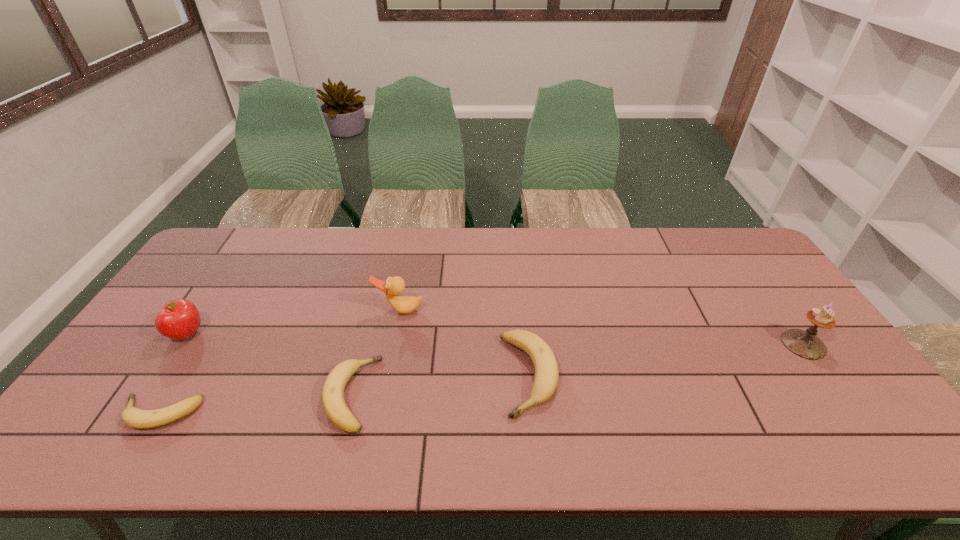
Where is `blank space located 0.070m on the back of the second shortest object`? blank space located 0.070m on the back of the second shortest object is located at coordinates (366, 339).

The height and width of the screenshot is (540, 960). I want to click on free space located 0.250m on the back of the fifth object from left to right, so click(x=519, y=279).

In order to click on free space located 0.110m on the right of the apple in this screenshot , I will do `click(243, 334)`.

Image resolution: width=960 pixels, height=540 pixels. Identify the location of blank space located 0.180m on the left of the candle holder. (718, 344).

Where is `vacant space located 0.330m on the beak of the duck`? vacant space located 0.330m on the beak of the duck is located at coordinates (379, 417).

In order to click on banana present at the left edge in this screenshot , I will do `click(134, 417)`.

The width and height of the screenshot is (960, 540). Find the location of `apple at the left edge`. apple at the left edge is located at coordinates (179, 319).

At what (x,y) coordinates should I click in order to perform the action: click on object at the right edge. Please return your answer as a coordinate pair (x, y). Looking at the image, I should click on (805, 344).

This screenshot has height=540, width=960. In order to click on object positioned at the near left corner in this screenshot , I will do `click(134, 417)`.

At what (x,y) coordinates should I click in order to perform the action: click on free space at the far edge. Please return your answer as a coordinate pair (x, y). Looking at the image, I should click on (317, 258).